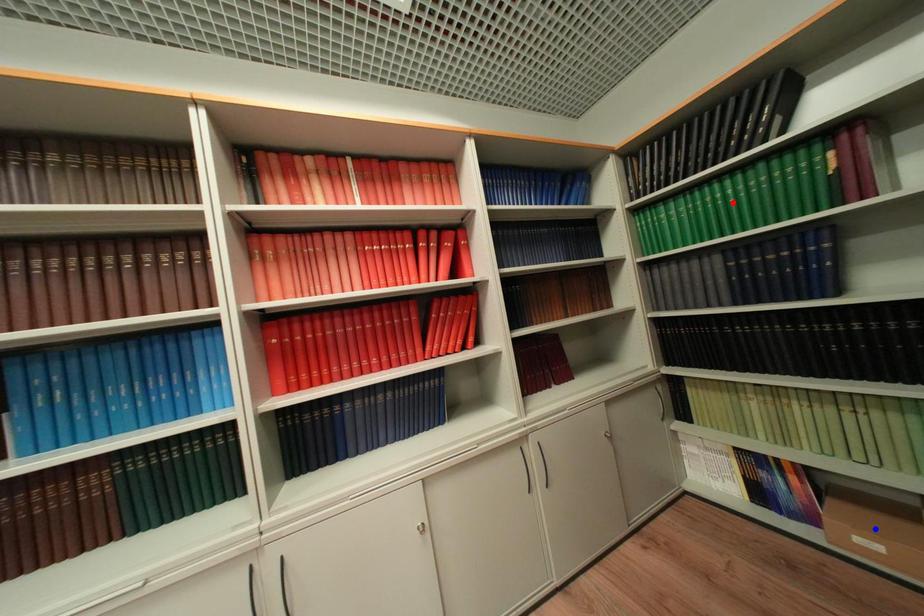
Question: Two points are marked on the image. Which point is closer to the camera?

Choices:
 (A) Blue point is closer.
 (B) Red point is closer.

Answer: (A)